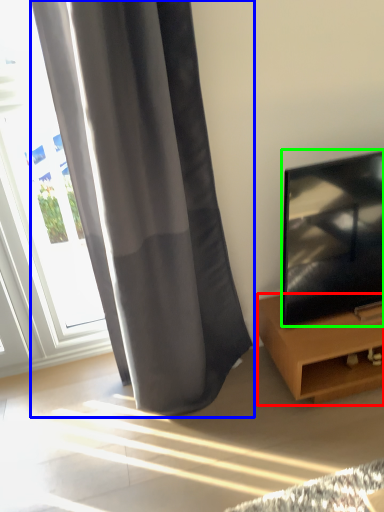
Question: Which is nearer to the furniture (highlighted by a red box)? curtain (highlighted by a blue box) or television (highlighted by a green box).

Choices:
 (A) curtain
 (B) television

Answer: (B)